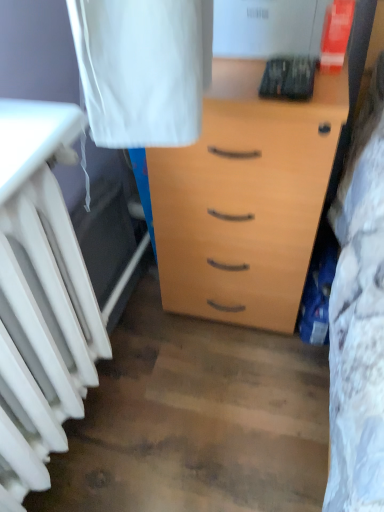
Question: From the image's perspective, is white matte radiator at left over light wood chest of drawers at center?

Choices:
 (A) no
 (B) yes

Answer: (A)

Question: Considering the relative sizes of white matte radiator at left and light wood chest of drawers at center in the image provided, is white matte radiator at left smaller than light wood chest of drawers at center?

Choices:
 (A) yes
 (B) no

Answer: (A)

Question: From a real-world perspective, is white matte radiator at left positioned over light wood chest of drawers at center based on gravity?

Choices:
 (A) yes
 (B) no

Answer: (A)

Question: Is white matte radiator at left to the left of light wood chest of drawers at center from the viewer's perspective?

Choices:
 (A) yes
 (B) no

Answer: (A)

Question: Considering the relative sizes of white matte radiator at left and light wood chest of drawers at center in the image provided, is white matte radiator at left shorter than light wood chest of drawers at center?

Choices:
 (A) yes
 (B) no

Answer: (A)

Question: From a real-world perspective, does white matte radiator at left sit lower than light wood chest of drawers at center?

Choices:
 (A) no
 (B) yes

Answer: (A)

Question: From the image's perspective, is light wood chest of drawers at center over white matte radiator at left?

Choices:
 (A) yes
 (B) no

Answer: (A)

Question: Is light wood chest of drawers at center bigger than white matte radiator at left?

Choices:
 (A) no
 (B) yes

Answer: (B)

Question: Is light wood chest of drawers at center far from white matte radiator at left?

Choices:
 (A) yes
 (B) no

Answer: (B)

Question: Is light wood chest of drawers at center turned away from white matte radiator at left?

Choices:
 (A) no
 (B) yes

Answer: (A)

Question: Does light wood chest of drawers at center have a lesser height compared to white matte radiator at left?

Choices:
 (A) yes
 (B) no

Answer: (B)

Question: Can you confirm if light wood chest of drawers at center is smaller than white matte radiator at left?

Choices:
 (A) no
 (B) yes

Answer: (A)

Question: Considering the positions of white matte radiator at left and light wood chest of drawers at center in the image, is white matte radiator at left taller or shorter than light wood chest of drawers at center?

Choices:
 (A) tall
 (B) short

Answer: (B)